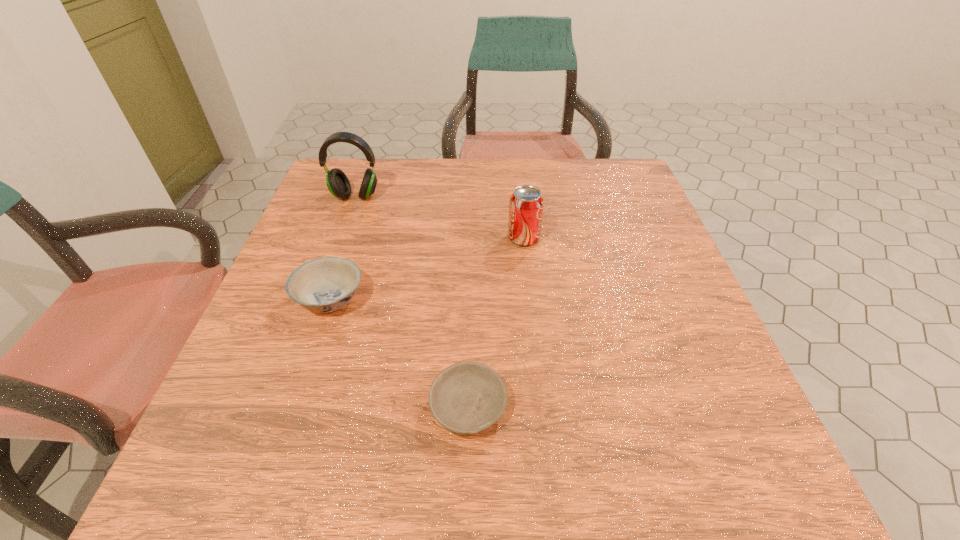
Locate an element on the screen. This screenshot has height=540, width=960. vacant space that satisfies the following two spatial constraints: 1. on the ear cups of the second shortest object; 2. on the left side of the tallest object is located at coordinates (319, 299).

Find the location of a particular element. Image resolution: width=960 pixels, height=540 pixels. vacant position in the image that satisfies the following two spatial constraints: 1. on the ear cups of the soda can; 2. on the right side of the farthest object is located at coordinates (341, 238).

Where is `vacant space that satisfies the following two spatial constraints: 1. on the ear cups of the tallest object; 2. on the right side of the second nearest object`? vacant space that satisfies the following two spatial constraints: 1. on the ear cups of the tallest object; 2. on the right side of the second nearest object is located at coordinates (319, 299).

This screenshot has height=540, width=960. I want to click on vacant area that satisfies the following two spatial constraints: 1. on the ear cups of the second shortest object; 2. on the left side of the farthest object, so click(x=319, y=299).